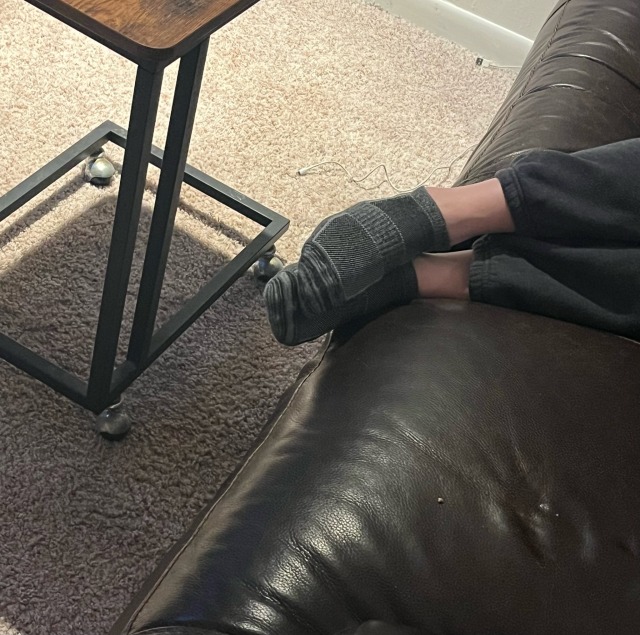
Locate an element on the screen. This screenshot has height=635, width=640. movable table is located at coordinates (146, 25).